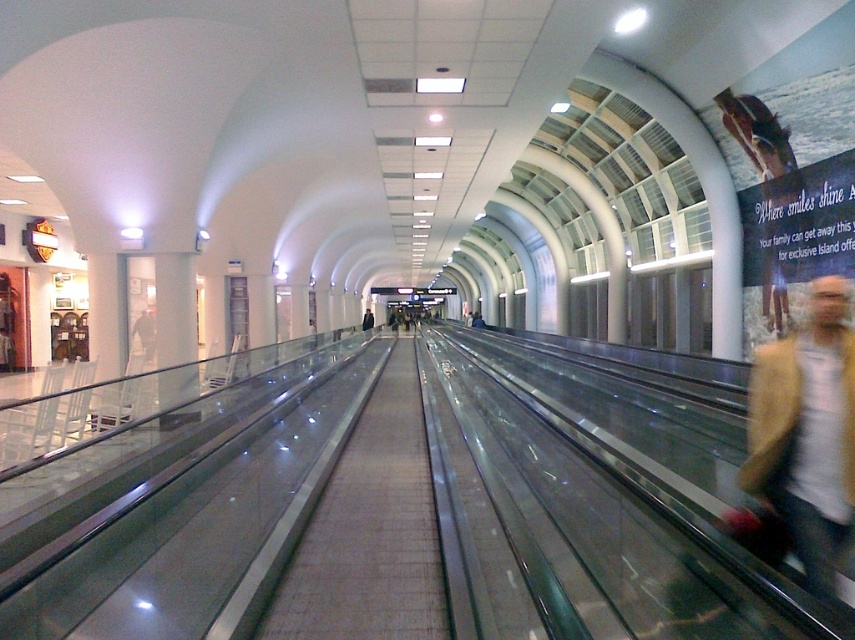
Question: Does light brown leather jacket at lower right have a smaller size compared to dark blue jacket at center?

Choices:
 (A) no
 (B) yes

Answer: (B)

Question: Which object is farther from the camera taking this photo?

Choices:
 (A) dark blue jacket at center
 (B) light brown leather jacket at lower right

Answer: (A)

Question: Is light brown leather jacket at lower right positioned before dark blue jacket at center?

Choices:
 (A) no
 (B) yes

Answer: (B)

Question: Which object is farther from the camera taking this photo?

Choices:
 (A) light brown leather jacket at lower right
 (B) dark blue jacket at center

Answer: (B)

Question: Does light brown leather jacket at lower right lie in front of dark blue jacket at center?

Choices:
 (A) yes
 (B) no

Answer: (A)